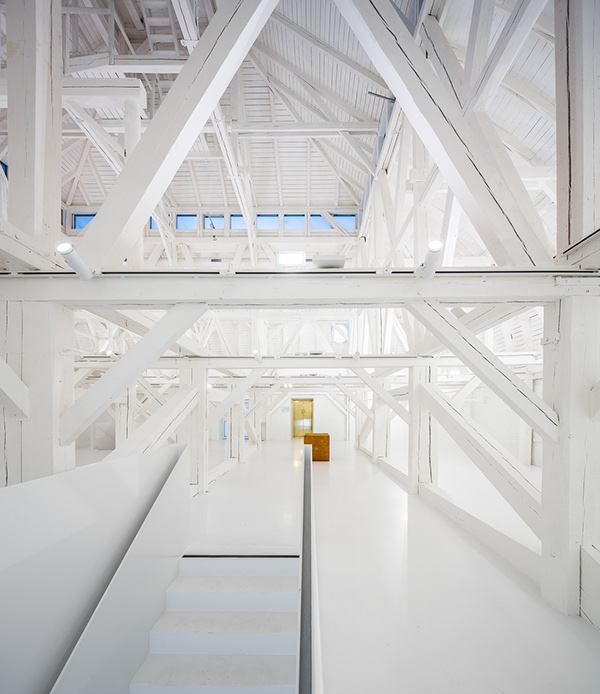
This screenshot has height=694, width=600. I want to click on window, so click(302, 409).